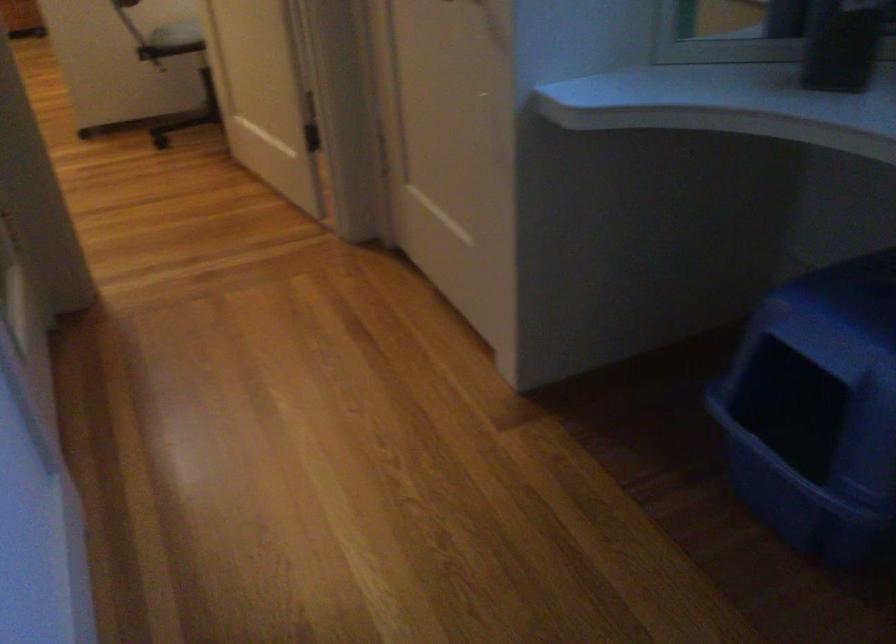
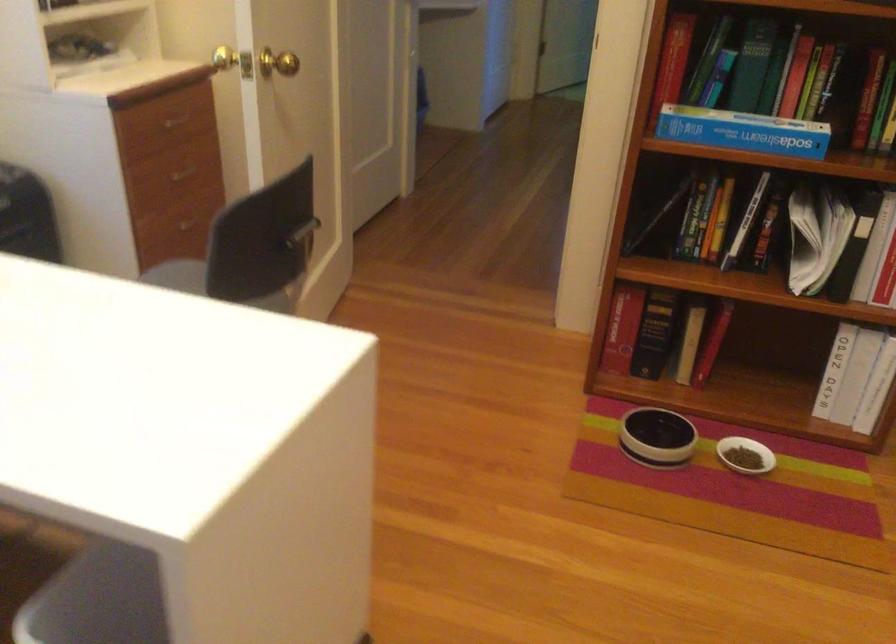
Find the pixel in the second image that matches [288,90] in the first image.

(304, 232)